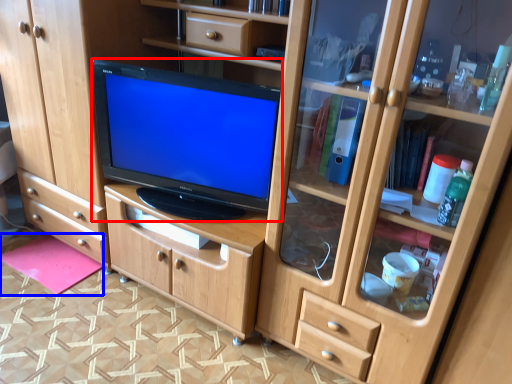
Question: Which point is closer to the camera, television (highlighted by a red box) or flat (highlighted by a blue box)?

Choices:
 (A) television
 (B) flat

Answer: (A)